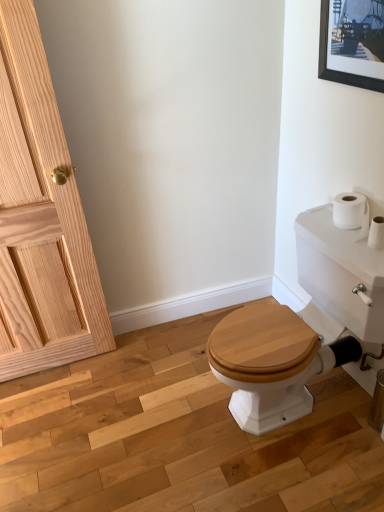
Question: Relative to black matte picture frame at upper right, is white glossy porcelain at right in front or behind?

Choices:
 (A) behind
 (B) front

Answer: (B)

Question: Based on their positions, is white glossy porcelain at right located to the left or right of black matte picture frame at upper right?

Choices:
 (A) right
 (B) left

Answer: (B)

Question: Considering the real-world distances, which object is farthest from the white matte toilet paper at upper right?

Choices:
 (A) white glossy porcelain at right
 (B) natural wood door at left
 (C) black matte picture frame at upper right

Answer: (B)

Question: Based on their relative distances, which object is nearer to the natural wood door at left?

Choices:
 (A) white matte toilet paper at upper right
 (B) white glossy porcelain at right
 (C) black matte picture frame at upper right

Answer: (B)